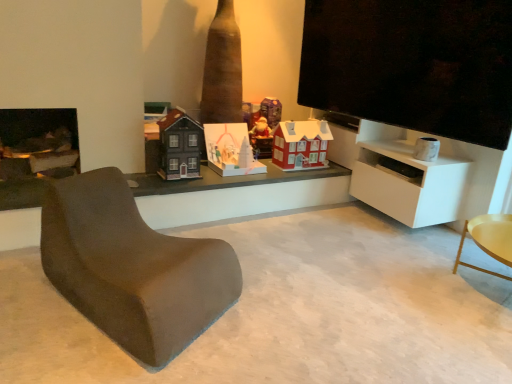
Find the location of a particular element. This screenshot has height=384, width=512. vacant space to the right of matte brown chair at lower left is located at coordinates (288, 307).